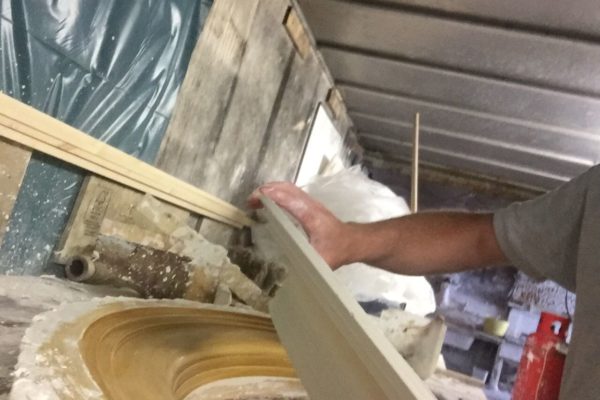
The image size is (600, 400). What are the coordinates of `yellow pot` in the screenshot? It's located at (496, 331).